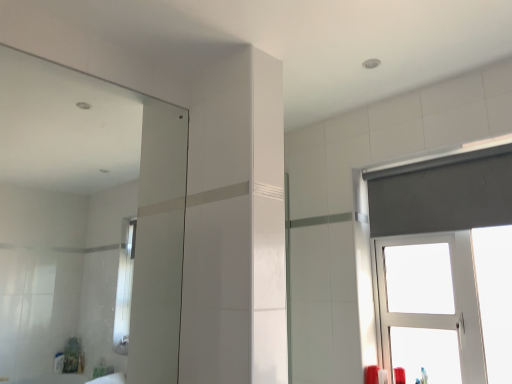
Question: From the image's perspective, is white plastic window at upper right under matte plastic toothbrush at lower right, the 2th toiletry viewed from the right?

Choices:
 (A) yes
 (B) no

Answer: (B)

Question: Is white plastic window at upper right in contact with matte plastic toothbrush at lower right, the first toiletry in the left-to-right sequence?

Choices:
 (A) yes
 (B) no

Answer: (B)

Question: From a real-world perspective, is white plastic window at upper right positioned under matte plastic toothbrush at lower right, the first toiletry in the left-to-right sequence, based on gravity?

Choices:
 (A) yes
 (B) no

Answer: (B)

Question: Can you confirm if white plastic window at upper right is bigger than matte plastic toothbrush at lower right, the first toiletry in the left-to-right sequence?

Choices:
 (A) no
 (B) yes

Answer: (B)

Question: Can we say white plastic window at upper right lies outside matte plastic toothbrush at lower right, the 2th toiletry viewed from the right?

Choices:
 (A) no
 (B) yes

Answer: (B)

Question: Is white plastic window at upper right shorter than matte plastic toothbrush at lower right, the first toiletry in the left-to-right sequence?

Choices:
 (A) yes
 (B) no

Answer: (B)

Question: From the image's perspective, would you say matte red candle at lower right, which is the first toiletry in right-to-left order, is positioned over white plastic window at upper right?

Choices:
 (A) no
 (B) yes

Answer: (A)

Question: Could you tell me if matte red candle at lower right, which is the first toiletry in right-to-left order, is facing white plastic window at upper right?

Choices:
 (A) yes
 (B) no

Answer: (B)

Question: Does matte red candle at lower right, which is the first toiletry in right-to-left order, have a greater width compared to white plastic window at upper right?

Choices:
 (A) yes
 (B) no

Answer: (B)

Question: From a real-world perspective, is matte red candle at lower right, acting as the 2th toiletry starting from the left, physically above white plastic window at upper right?

Choices:
 (A) no
 (B) yes

Answer: (A)

Question: Considering the relative sizes of matte red candle at lower right, acting as the 2th toiletry starting from the left, and white plastic window at upper right in the image provided, is matte red candle at lower right, acting as the 2th toiletry starting from the left, shorter than white plastic window at upper right?

Choices:
 (A) no
 (B) yes

Answer: (B)

Question: From a real-world perspective, is matte red candle at lower right, acting as the 2th toiletry starting from the left, positioned under white plastic window at upper right based on gravity?

Choices:
 (A) yes
 (B) no

Answer: (A)

Question: From the image's perspective, is white plastic window at upper right under clear glass mirror at upper left?

Choices:
 (A) yes
 (B) no

Answer: (A)